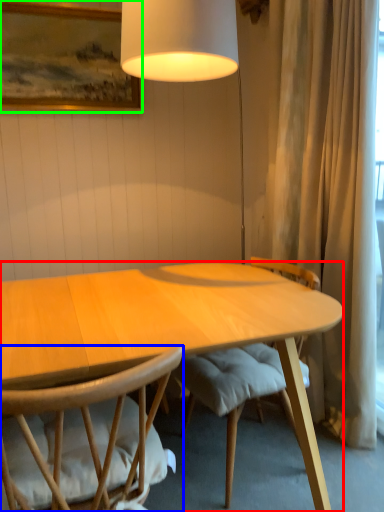
Question: Which object is the farthest from desk (highlighted by a red box)? Choose among these: chair (highlighted by a blue box) or picture frame (highlighted by a green box).

Choices:
 (A) chair
 (B) picture frame

Answer: (B)